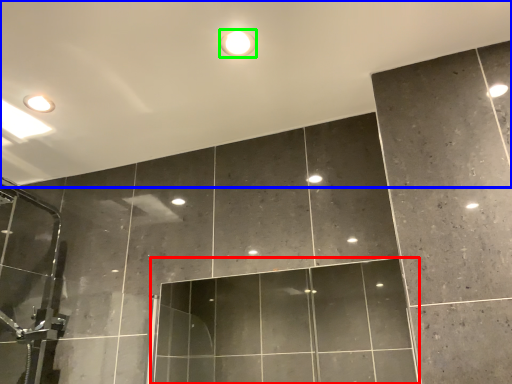
Question: Which is nearer to the glass door (highlighted by a red box)? backdrop (highlighted by a blue box) or droplight (highlighted by a green box).

Choices:
 (A) backdrop
 (B) droplight

Answer: (A)